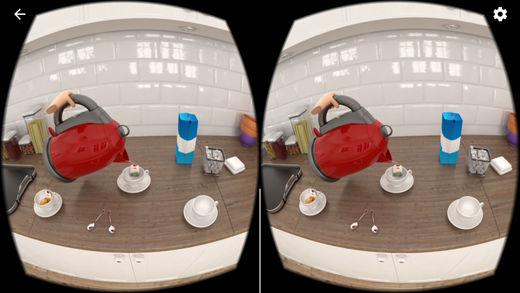
I want to click on subway tile, so click(x=124, y=87), click(x=354, y=79).